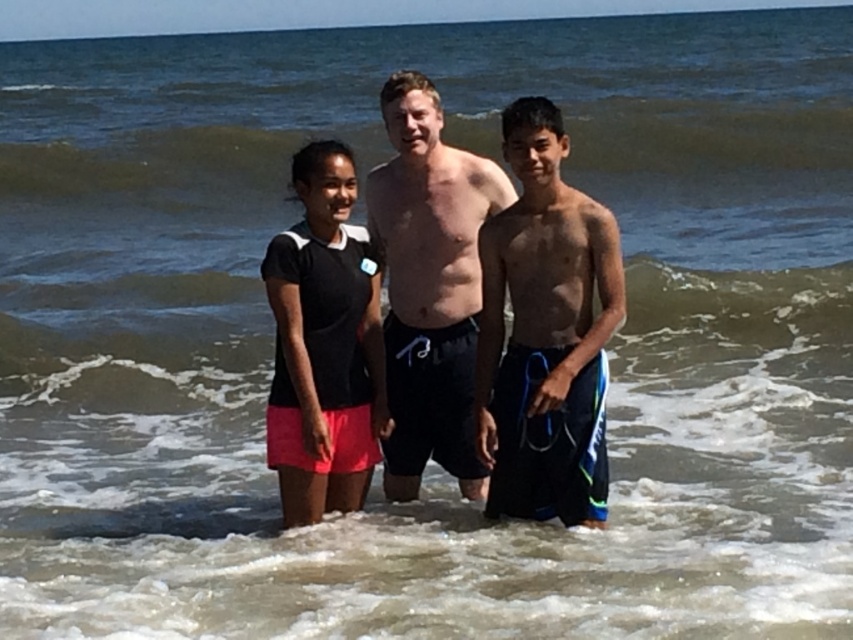
Question: Which object appears closest to the camera in this image?

Choices:
 (A) black matte shorts at center
 (B) blue striped shorts at center

Answer: (B)

Question: Is black matte shorts at center below black matte skirt at center?

Choices:
 (A) yes
 (B) no

Answer: (B)

Question: Which object is positioned closest to the black matte shorts at center?

Choices:
 (A) black matte skirt at center
 (B) blue striped shorts at center

Answer: (A)

Question: In this image, where is black matte shorts at center located relative to black matte skirt at center?

Choices:
 (A) left
 (B) right

Answer: (B)

Question: Considering the real-world distances, which object is closest to the blue striped shorts at center?

Choices:
 (A) black matte skirt at center
 (B) black matte shorts at center

Answer: (B)

Question: Is blue striped shorts at center above black matte skirt at center?

Choices:
 (A) yes
 (B) no

Answer: (A)